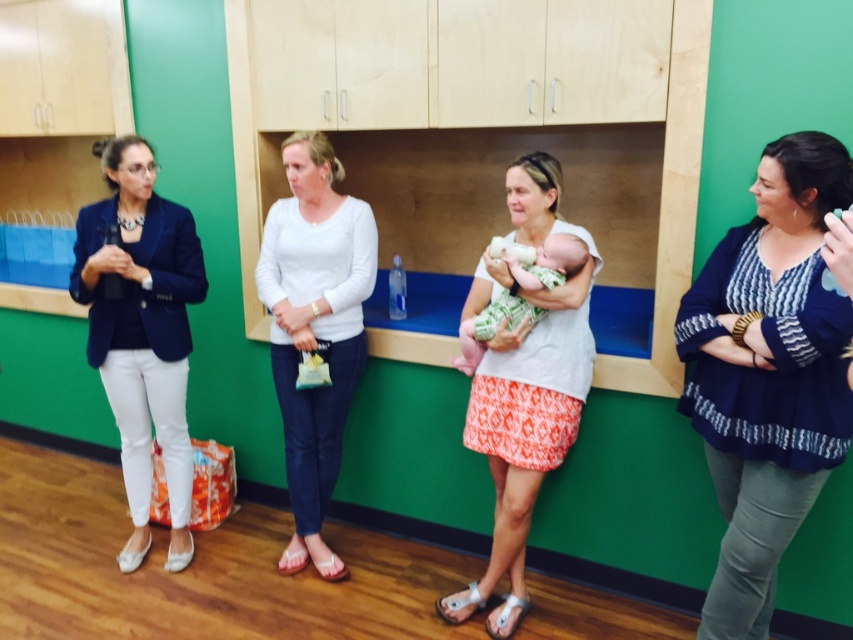
Does matte black blazer at left have a greater width compared to white cotton shirt at center?

In fact, matte black blazer at left might be narrower than white cotton shirt at center.

Does matte black blazer at left appear over white cotton shirt at center?

Yes.

Is point (131, 227) closer to viewer compared to point (474, 451)?

Yes, it is in front of point (474, 451).

Identify the location of matte black blazer at left. (142, 332).

Which of these two, blue striped blouse at right or white cotton shirt at center, stands shorter?

blue striped blouse at right is shorter.

Where is `blue striped blouse at right`? blue striped blouse at right is located at coordinates (769, 372).

The width and height of the screenshot is (853, 640). Find the location of `blue striped blouse at right`. blue striped blouse at right is located at coordinates (769, 372).

Describe the element at coordinates (142, 332) in the screenshot. The height and width of the screenshot is (640, 853). I see `matte black blazer at left` at that location.

The width and height of the screenshot is (853, 640). Find the location of `matte black blazer at left`. matte black blazer at left is located at coordinates (142, 332).

Identify the location of matte black blazer at left. (142, 332).